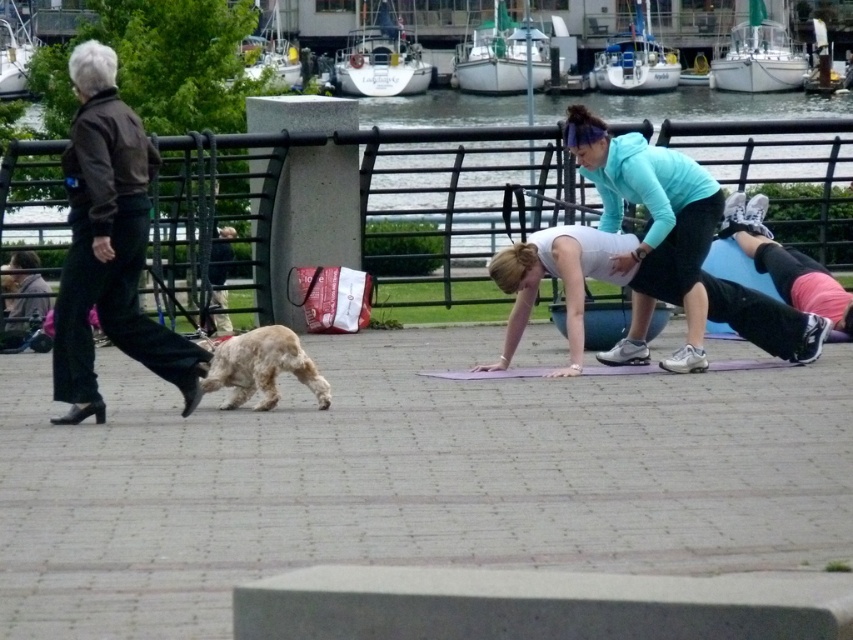
You are a photographer trying to capture the light brown fur at lower left and the purple rubber yoga mat at center in a single shot. Which object will appear smaller in your photo?

The light brown fur at lower left will appear smaller in the photo because it is thinner than the purple rubber yoga mat at center.

You are a photographer trying to capture a closeup of the teal fleece jacket at center and the purple rubber yoga mat at center. Given that your camera can only focus on one object at a time, which object should you choose to ensure the subject is in focus if you want the larger object to be sharp?

The teal fleece jacket at center is larger in size than the purple rubber yoga mat at center, so you should focus on the teal fleece jacket at center to ensure the larger object is sharp.

You are standing at the point labeled point (x=691, y=189) and want to move to point (x=459, y=372). Which direction should you move to get closer to the dog walking on the left side of the waterfront?

Since point (x=691, y=189) is closer to the viewer than point (x=459, y=372), you should move towards the direction of the dog walking on the left side of the waterfront by moving away from the viewer towards point (x=459, y=372).